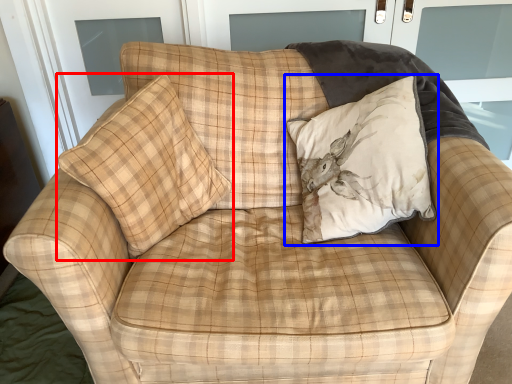
Question: Which of the following is the closest to the observer, pillow (highlighted by a red box) or pillow (highlighted by a blue box)?

Choices:
 (A) pillow
 (B) pillow

Answer: (A)